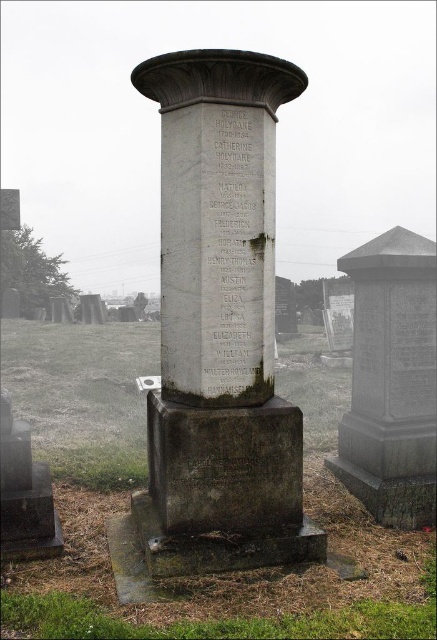
Question: Can you confirm if granite stone column at center is thinner than granite stone monument at center?

Choices:
 (A) no
 (B) yes

Answer: (A)

Question: Estimate the real-world distances between objects in this image. Which object is closer to the white marble stone at center?

Choices:
 (A) black stone inscription at lower center
 (B) granite stone column at center
 (C) granite stone monument at center

Answer: (B)

Question: From the image, what is the correct spatial relationship of granite stone column at center in relation to white marble stone at center?

Choices:
 (A) below
 (B) above

Answer: (A)

Question: Which point appears farthest from the camera in this image?

Choices:
 (A) pos(197,164)
 (B) pos(218,465)
 (C) pos(263,154)
 (D) pos(380,499)

Answer: (D)

Question: Observing the image, what is the correct spatial positioning of granite stone column at center in reference to granite stone monument at center?

Choices:
 (A) below
 (B) above

Answer: (B)

Question: Considering the real-world distances, which object is farthest from the black stone inscription at lower center?

Choices:
 (A) granite stone monument at center
 (B) granite stone column at center

Answer: (A)